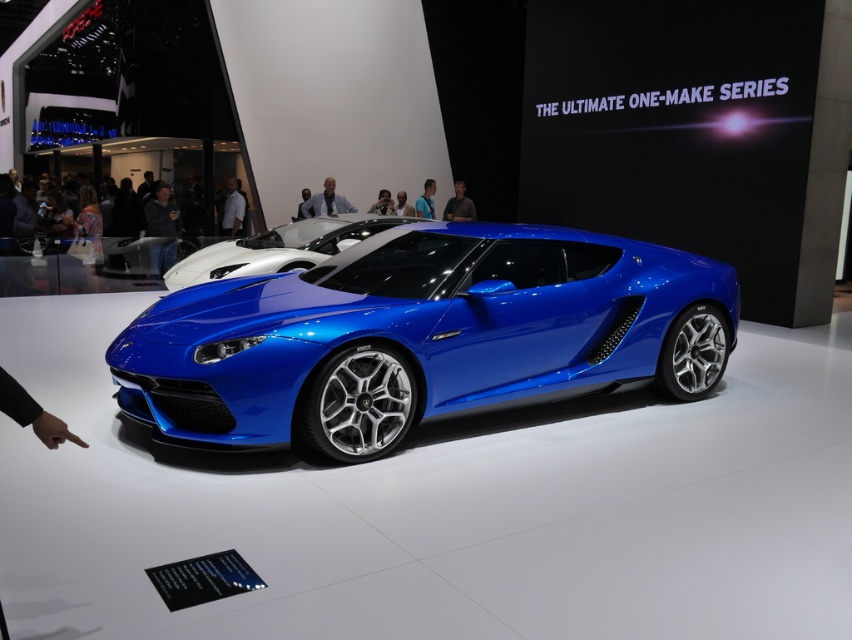
Question: Which object appears farthest from the camera in this image?

Choices:
 (A) light blue shirt at center
 (B) shiny blue sports car at center

Answer: (A)

Question: Is white smooth shirt at center wider than dark gray shirt at center?

Choices:
 (A) yes
 (B) no

Answer: (B)

Question: Can you confirm if light blue shirt at center is wider than dark gray shirt at center?

Choices:
 (A) yes
 (B) no

Answer: (A)

Question: Which of the following is the closest to the observer?

Choices:
 (A) shiny blue car at center
 (B) matte black camera at upper center
 (C) dark gray shirt at center

Answer: (A)

Question: Which of the following is the closest to the observer?

Choices:
 (A) (450, 196)
 (B) (337, 195)

Answer: (B)

Question: Does dark gray shirt at center appear over blue metallic shirt at center?

Choices:
 (A) no
 (B) yes

Answer: (A)